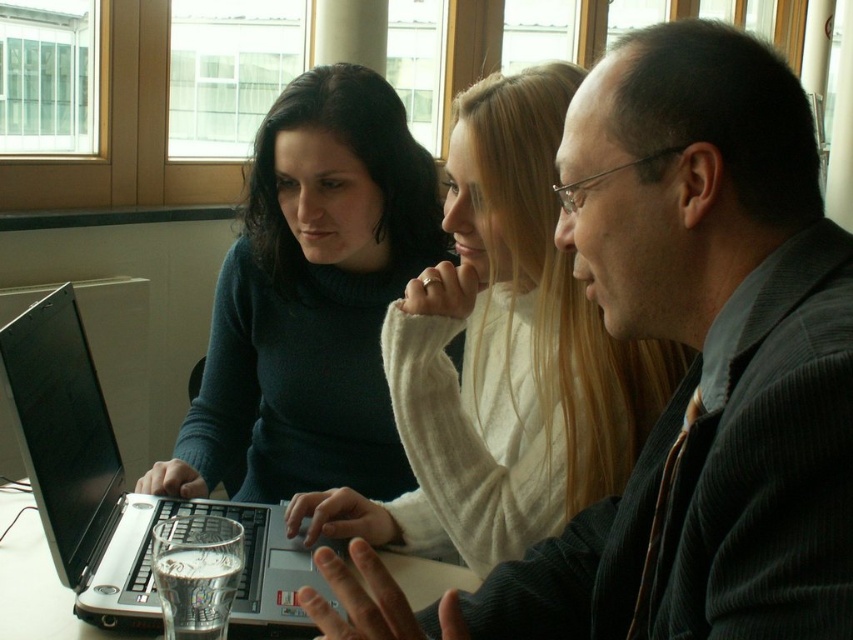
Does dark gray suit at center have a lesser height compared to silver metallic laptop at center?

Incorrect, dark gray suit at center's height does not fall short of silver metallic laptop at center's.

From the picture: Does dark gray suit at center have a greater width compared to silver metallic laptop at center?

Incorrect, dark gray suit at center's width does not surpass silver metallic laptop at center's.

Between point (798, 260) and point (254, 538), which one is positioned in front?

Point (798, 260) is in front.

Where is `dark gray suit at center`? The height and width of the screenshot is (640, 853). dark gray suit at center is located at coordinates (688, 371).

Is black glossy laptop at left to the left of clear glass table at center from the viewer's perspective?

Incorrect, black glossy laptop at left is not on the left side of clear glass table at center.

Which of these two, black glossy laptop at left or clear glass table at center, stands taller?

Standing taller between the two is black glossy laptop at left.

The height and width of the screenshot is (640, 853). I want to click on black glossy laptop at left, so click(x=62, y=433).

Where is `black glossy laptop at left`? The width and height of the screenshot is (853, 640). black glossy laptop at left is located at coordinates (62, 433).

Looking at this image, measure the distance from silver metallic laptop at center to clear glass table at center.

A distance of 6.88 inches exists between silver metallic laptop at center and clear glass table at center.

Does silver metallic laptop at center have a lesser height compared to clear glass table at center?

Incorrect, silver metallic laptop at center's height does not fall short of clear glass table at center's.

Who is more distant from viewer, [289,557] or [0,605]?

The point [289,557] is behind.

The width and height of the screenshot is (853, 640). I want to click on silver metallic laptop at center, so click(120, 490).